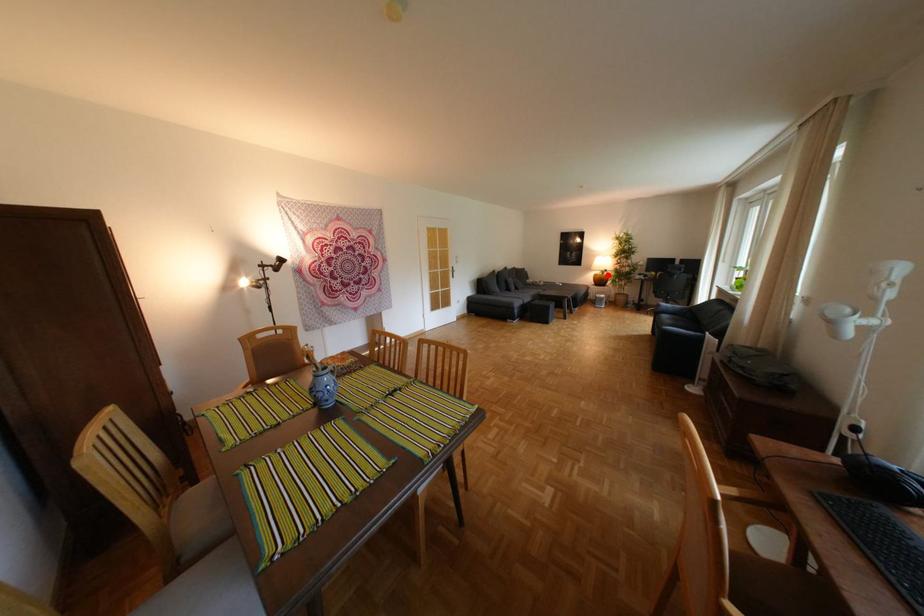
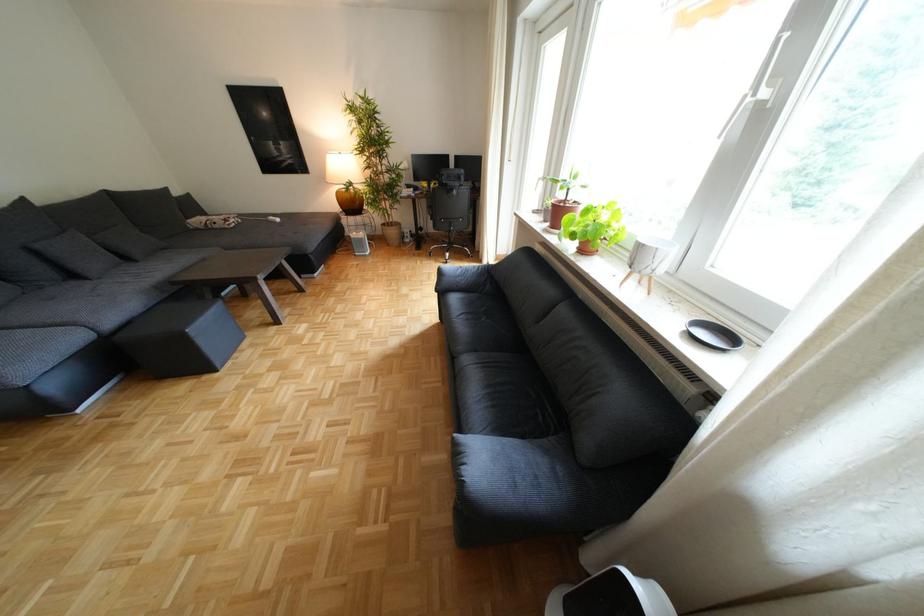
Find the pixel in the second image that matches the highlighted location in the first image.

(351, 193)